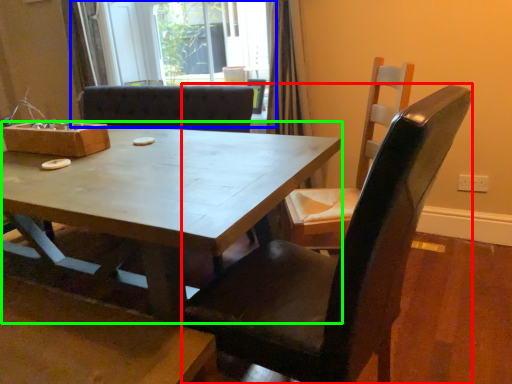
Question: Estimate the real-world distances between objects in this image. Which object is farther from chair (highlighted by a red box), glass door (highlighted by a blue box) or coffee table (highlighted by a green box)?

Choices:
 (A) glass door
 (B) coffee table

Answer: (A)